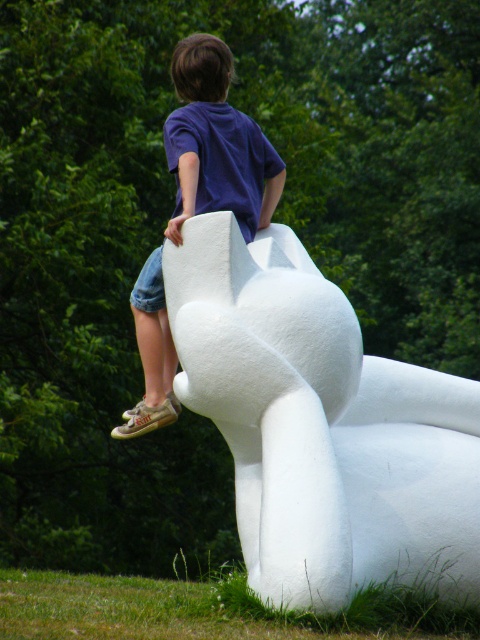
Question: Which point is farther from the camera taking this photo?

Choices:
 (A) (183, 186)
 (B) (312, 576)

Answer: (A)

Question: Is white matte sculpture at upper center to the left of matte blue shirt at upper center from the viewer's perspective?

Choices:
 (A) yes
 (B) no

Answer: (B)

Question: Is white matte sculpture at upper center wider than matte blue shirt at upper center?

Choices:
 (A) yes
 (B) no

Answer: (A)

Question: Considering the relative positions of white matte sculpture at upper center and matte blue shirt at upper center in the image provided, where is white matte sculpture at upper center located with respect to matte blue shirt at upper center?

Choices:
 (A) above
 (B) below

Answer: (B)

Question: Which object appears closest to the camera in this image?

Choices:
 (A) matte blue shirt at upper center
 (B) white matte sculpture at upper center

Answer: (B)